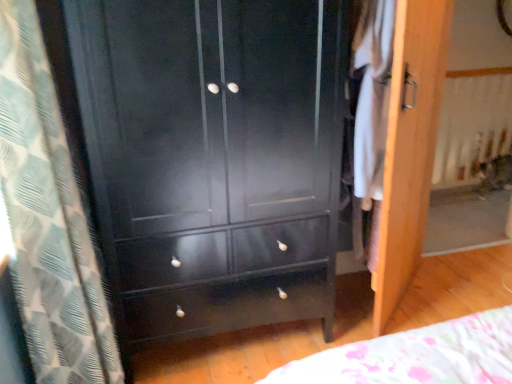
Question: Can you confirm if white textured curtain at left is thinner than wooden screen door at right?

Choices:
 (A) yes
 (B) no

Answer: (B)

Question: Is white textured curtain at left to the left of wooden screen door at right from the viewer's perspective?

Choices:
 (A) yes
 (B) no

Answer: (A)

Question: Would you say white textured curtain at left is a long distance from wooden screen door at right?

Choices:
 (A) yes
 (B) no

Answer: (A)

Question: Is white textured curtain at left next to wooden screen door at right?

Choices:
 (A) yes
 (B) no

Answer: (B)

Question: Can you confirm if white textured curtain at left is taller than wooden screen door at right?

Choices:
 (A) no
 (B) yes

Answer: (B)

Question: In terms of width, does matte black cabinet at center look wider or thinner when compared to wooden screen door at right?

Choices:
 (A) wide
 (B) thin

Answer: (A)

Question: Considering the positions of matte black cabinet at center and wooden screen door at right in the image, is matte black cabinet at center taller or shorter than wooden screen door at right?

Choices:
 (A) tall
 (B) short

Answer: (A)

Question: From the image's perspective, is matte black cabinet at center above or below wooden screen door at right?

Choices:
 (A) below
 (B) above

Answer: (A)

Question: Is matte black cabinet at center to the left or to the right of wooden screen door at right in the image?

Choices:
 (A) left
 (B) right

Answer: (A)

Question: Considering their positions, is white fabric at right located in front of or behind white textured curtain at left?

Choices:
 (A) behind
 (B) front

Answer: (A)

Question: From their relative heights in the image, would you say white fabric at right is taller or shorter than white textured curtain at left?

Choices:
 (A) tall
 (B) short

Answer: (B)

Question: Considering the positions of white fabric at right and white textured curtain at left in the image, is white fabric at right bigger or smaller than white textured curtain at left?

Choices:
 (A) small
 (B) big

Answer: (A)

Question: From a real-world perspective, is white fabric at right positioned above or below white textured curtain at left?

Choices:
 (A) above
 (B) below

Answer: (A)

Question: Do you think matte black cabinet at center is within white fabric at right, or outside of it?

Choices:
 (A) inside
 (B) outside

Answer: (B)

Question: From the image's perspective, is matte black cabinet at center located above or below white fabric at right?

Choices:
 (A) below
 (B) above

Answer: (A)